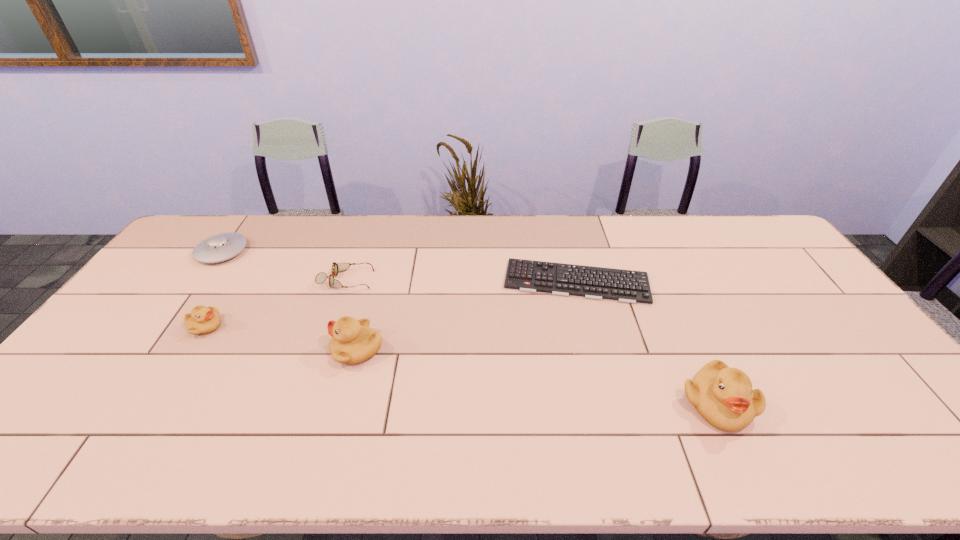
At what (x,y) coordinates should I click in order to perform the action: click on free spot located 0.390m on the front-facing side of the fifth shortest object. Please return your answer as a coordinate pair (x, y). The image size is (960, 540). Looking at the image, I should click on (188, 349).

This screenshot has height=540, width=960. I want to click on free space located 0.320m on the front-facing side of the fifth shortest object, so click(213, 349).

Where is `free spot located 0.230m on the front-facing side of the fifth shortest object`? This screenshot has width=960, height=540. free spot located 0.230m on the front-facing side of the fifth shortest object is located at coordinates (247, 349).

Where is `vacant space located 0.190m on the right of the third shortest object`? Image resolution: width=960 pixels, height=540 pixels. vacant space located 0.190m on the right of the third shortest object is located at coordinates tap(301, 251).

Locate an element on the screen. free spot located on the right of the computer keyboard is located at coordinates click(665, 281).

Identify the location of vacant space positioned on the front-facing side of the spectacles. (491, 280).

In order to click on object that is positioned at the far edge in this screenshot , I will do `click(220, 247)`.

Locate an element on the screen. object situated at the near edge is located at coordinates (723, 396).

Find the location of a particular element. The width and height of the screenshot is (960, 540). object that is at the left edge is located at coordinates (220, 247).

Locate an element on the screen. The width and height of the screenshot is (960, 540). object that is at the far left corner is located at coordinates (220, 247).